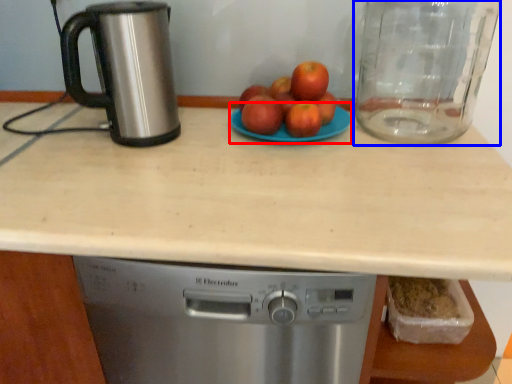
Question: Which of the following is the closest to the observer, glass plate (highlighted by a red box) or glass jar (highlighted by a blue box)?

Choices:
 (A) glass plate
 (B) glass jar

Answer: (B)